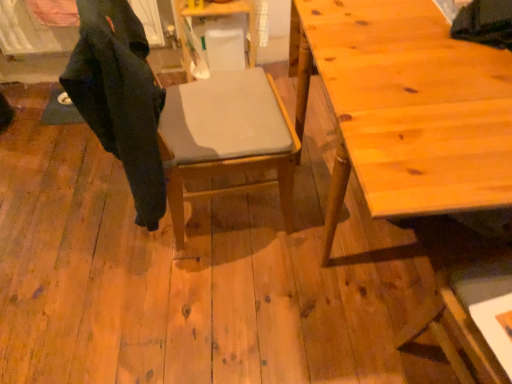
Where is `vacant space to the left of wooden table at right, which is counted as the 1th table, starting from the front`? This screenshot has width=512, height=384. vacant space to the left of wooden table at right, which is counted as the 1th table, starting from the front is located at coordinates (202, 289).